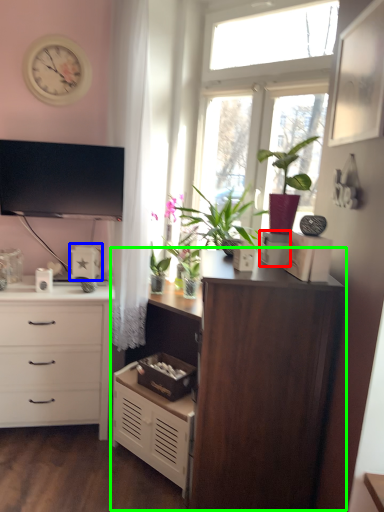
Question: Which is nearer to the storage box (highlighted by a red box)? appliance (highlighted by a blue box) or cupboard (highlighted by a green box).

Choices:
 (A) appliance
 (B) cupboard

Answer: (B)